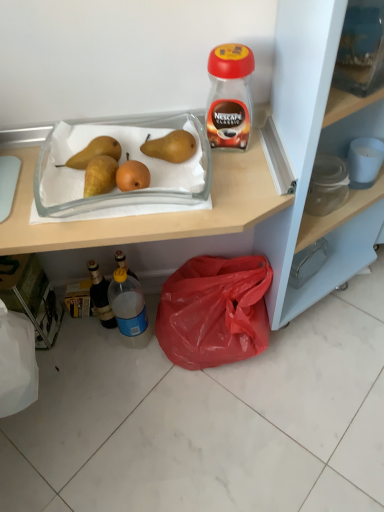
Find the location of a particular element. This screenshot has width=384, height=512. free location to the left of red plastic bag at lower right is located at coordinates click(x=114, y=362).